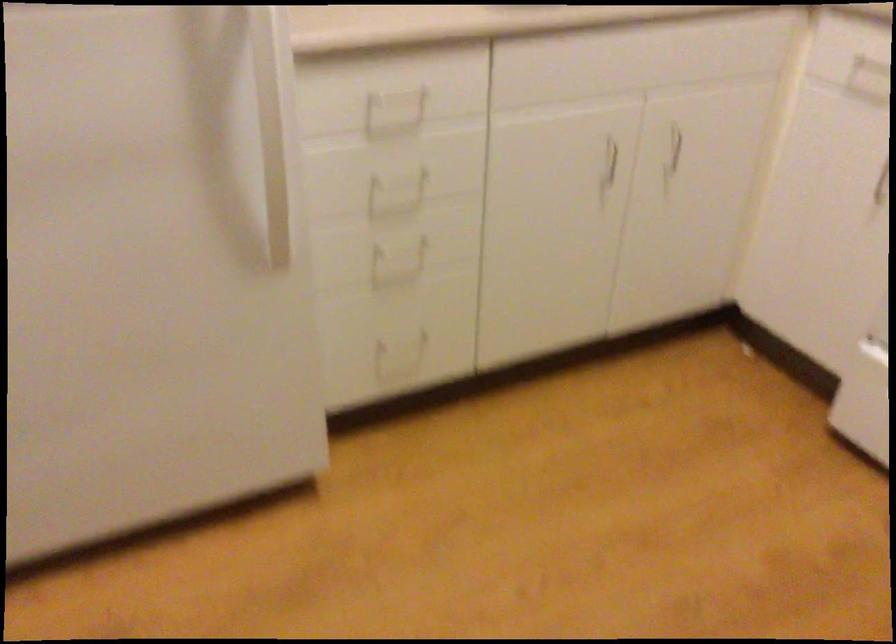
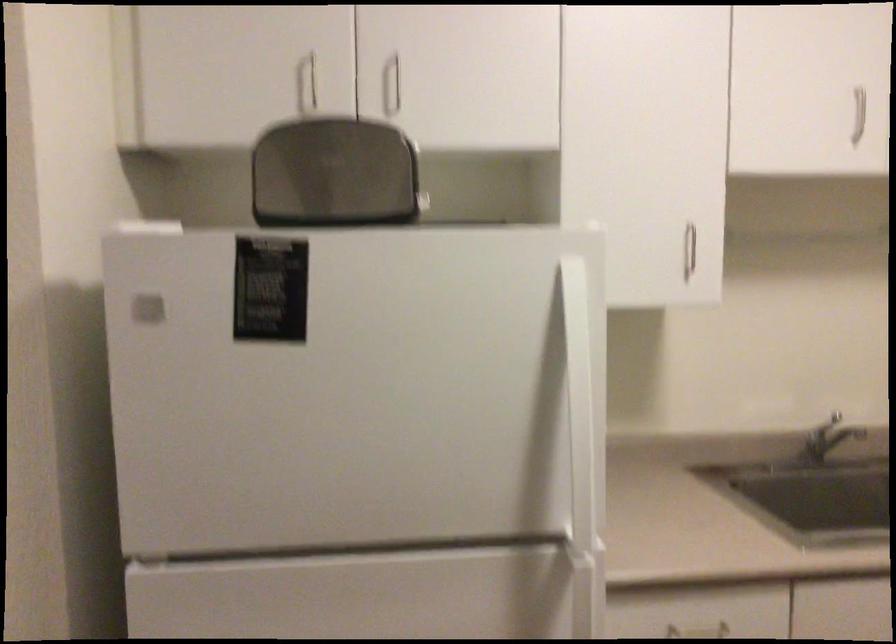
Based on the continuous images, in which direction is the camera rotating?

The rotation direction of the camera is left-up.